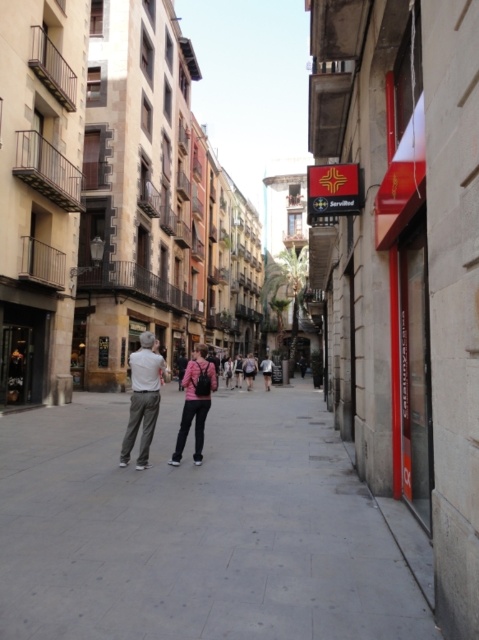
Question: Does khaki pants at center have a larger size compared to light pink fabric at center?

Choices:
 (A) yes
 (B) no

Answer: (B)

Question: Is khaki pants at center positioned behind pink matte jacket at center?

Choices:
 (A) no
 (B) yes

Answer: (A)

Question: Among these points, which one is farthest from the camera?

Choices:
 (A) (263, 365)
 (B) (152, 349)

Answer: (A)

Question: Can you confirm if pink matte jacket at center is smaller than light pink fabric at center?

Choices:
 (A) no
 (B) yes

Answer: (A)

Question: Which point is farther to the camera?

Choices:
 (A) (239, 365)
 (B) (207, 397)
 (C) (132, 376)
 (D) (319, 416)

Answer: (A)

Question: Which point appears farthest from the camera in this image?

Choices:
 (A) (266, 369)
 (B) (125, 452)

Answer: (A)